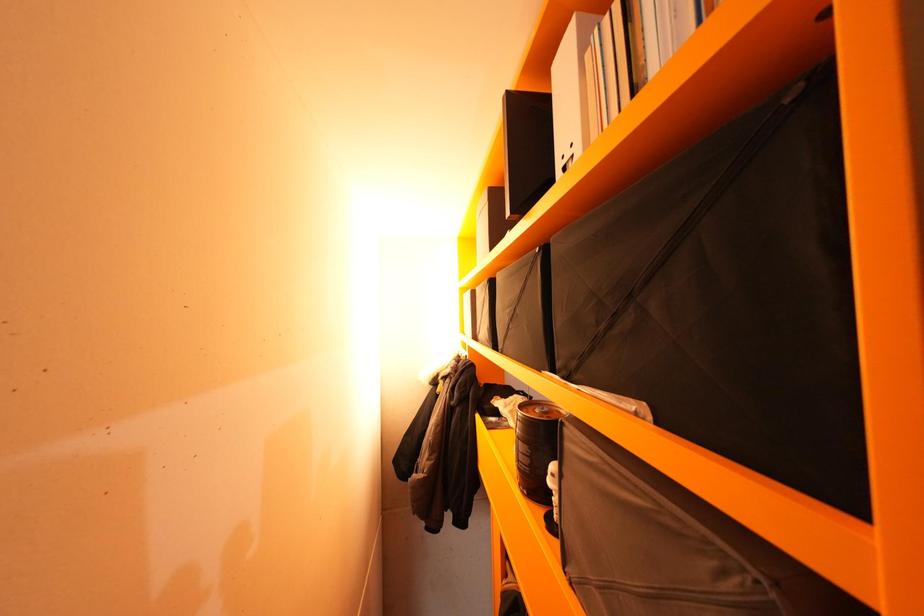
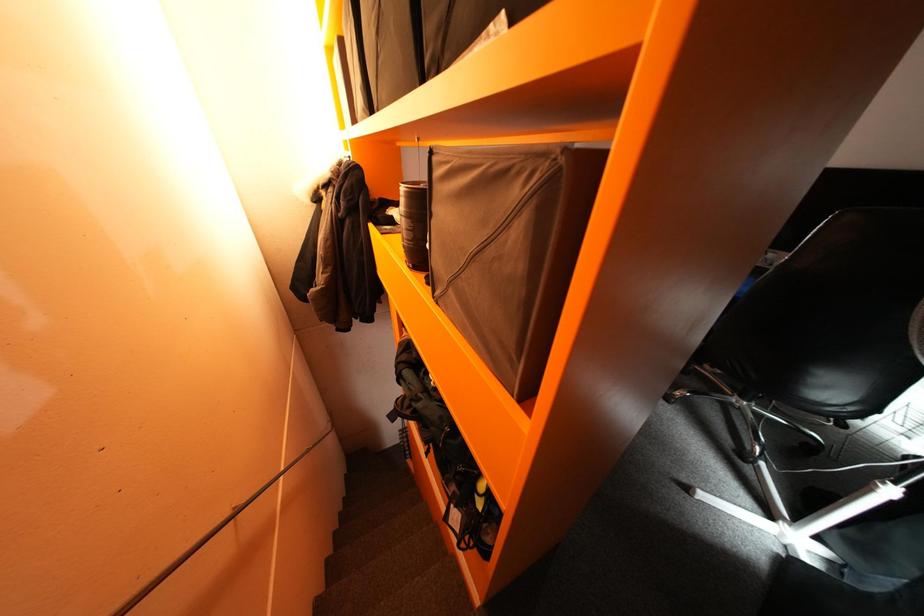
The images are taken continuously from a first-person perspective. In which direction is your viewpoint rotating?

The camera rotated toward right-down.